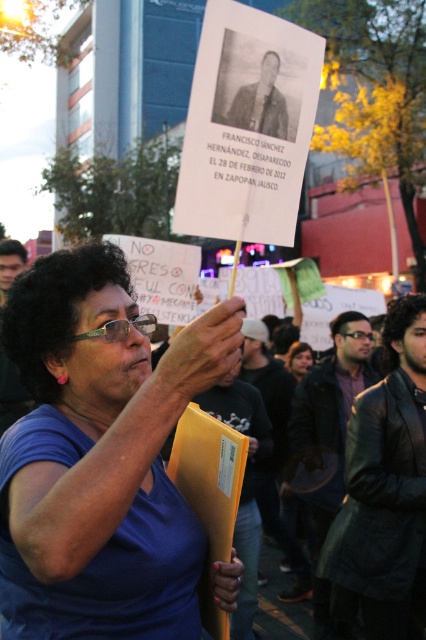
Who is positioned more to the right, yellow paper folder at center or blonde hair at center?

Positioned to the right is blonde hair at center.

Does yellow paper folder at center appear under blonde hair at center?

Correct, yellow paper folder at center is located below blonde hair at center.

Locate an element on the screen. This screenshot has width=426, height=640. yellow paper folder at center is located at coordinates (242, 483).

At what (x,y) coordinates should I click in order to perform the action: click on yellow paper folder at center. Please return your answer as a coordinate pair (x, y). Image resolution: width=426 pixels, height=640 pixels. Looking at the image, I should click on (242, 483).

Image resolution: width=426 pixels, height=640 pixels. What do you see at coordinates (385, 486) in the screenshot?
I see `leather jacket at center` at bounding box center [385, 486].

Can you confirm if leather jacket at center is bigger than blonde hair at center?

Correct, leather jacket at center is larger in size than blonde hair at center.

Which is behind, point (385, 609) or point (290, 348)?

Point (290, 348)

I want to click on leather jacket at center, so click(385, 486).

Is blue fabric shirt at center to the left of dark brown leather jacket at center from the viewer's perspective?

Indeed, blue fabric shirt at center is positioned on the left side of dark brown leather jacket at center.

Who is taller, blue fabric shirt at center or dark brown leather jacket at center?

dark brown leather jacket at center is taller.

Describe the element at coordinates (100, 456) in the screenshot. I see `blue fabric shirt at center` at that location.

This screenshot has height=640, width=426. In order to click on blue fabric shirt at center in this screenshot , I will do `click(100, 456)`.